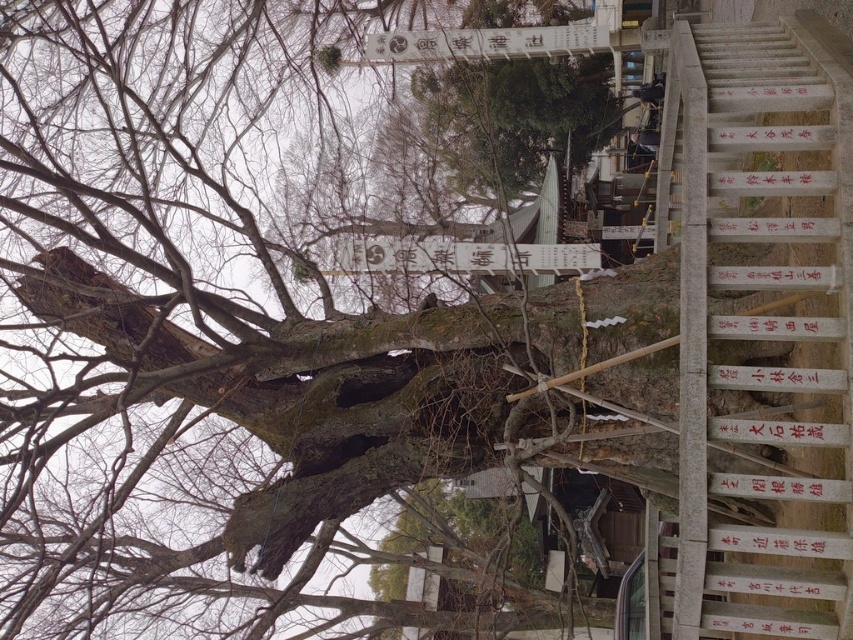
Question: Which object is the closest to the white wood sign at upper center?

Choices:
 (A) white paper sign at center
 (B) white stone stairs at right

Answer: (A)

Question: Is white paper sign at center positioned behind white wood sign at upper center?

Choices:
 (A) yes
 (B) no

Answer: (B)

Question: Is white stone stairs at right closer to camera compared to white paper sign at center?

Choices:
 (A) no
 (B) yes

Answer: (B)

Question: Which point appears closest to the camera in this image?

Choices:
 (A) (503, 51)
 (B) (378, 248)

Answer: (A)

Question: Which object is the farthest from the white wood sign at upper center?

Choices:
 (A) white paper sign at center
 (B) white stone stairs at right

Answer: (B)

Question: Is white stone stairs at right behind white wood sign at upper center?

Choices:
 (A) yes
 (B) no

Answer: (B)